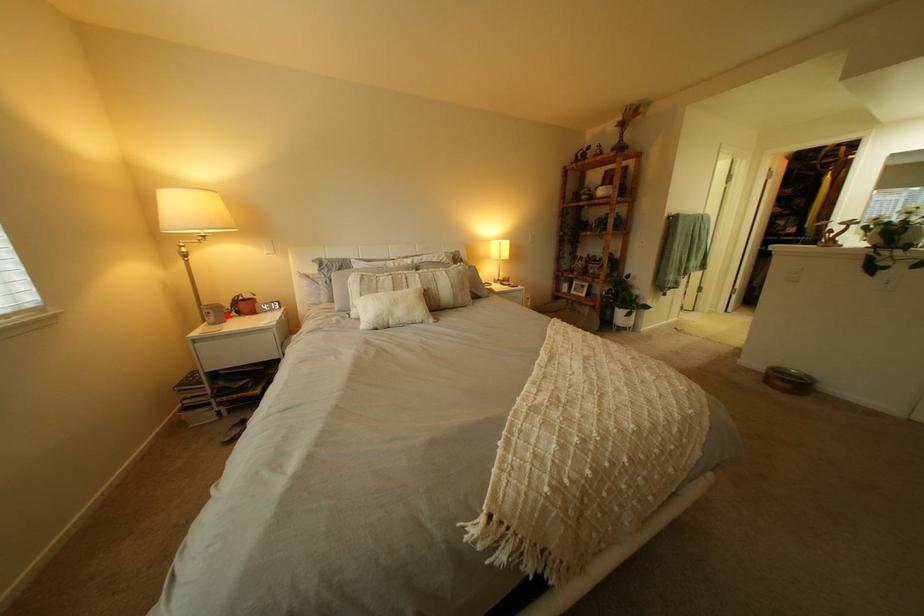
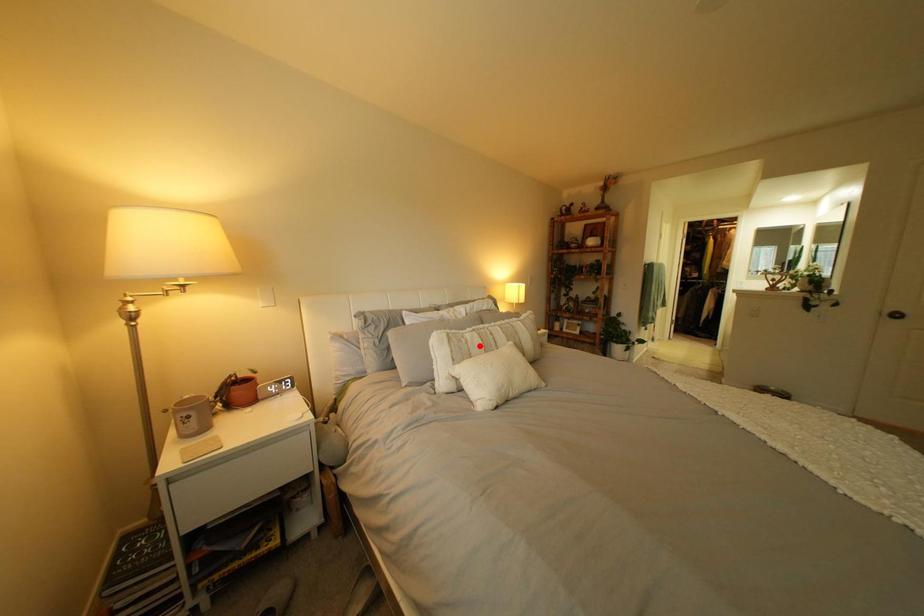
I am providing you with two images of the same scene from different viewpoints. A red point is marked on the first image and another point is marked on the second image. Is the red point in image1 aligned with the point shown in image2?

No